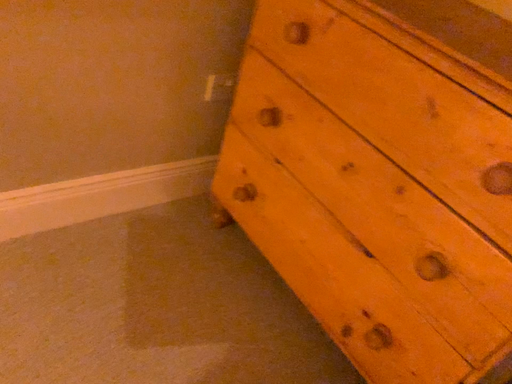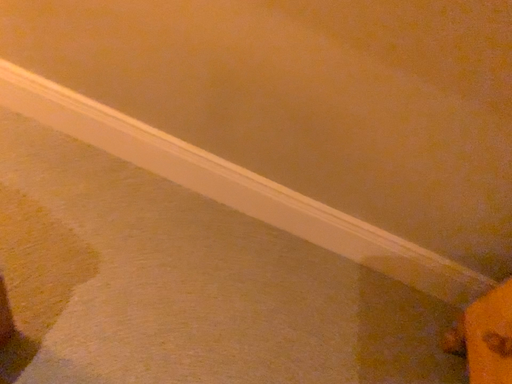
Question: Which way did the camera rotate in the video?

Choices:
 (A) rotated right
 (B) rotated left

Answer: (B)